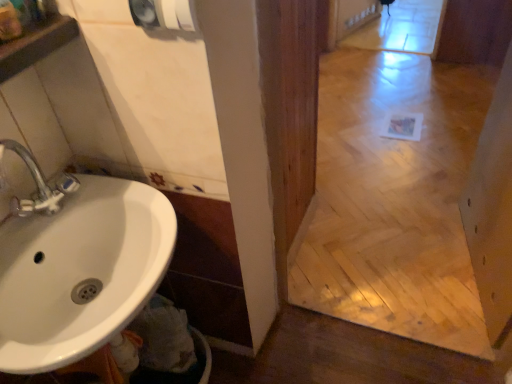
Question: In terms of height, does matte gray hand dryer at upper center look taller or shorter compared to white glossy sink at lower left?

Choices:
 (A) short
 (B) tall

Answer: (A)

Question: Considering the positions of matte gray hand dryer at upper center and white glossy sink at lower left in the image, is matte gray hand dryer at upper center bigger or smaller than white glossy sink at lower left?

Choices:
 (A) small
 (B) big

Answer: (A)

Question: From the image's perspective, is matte gray hand dryer at upper center positioned above or below white glossy sink at lower left?

Choices:
 (A) below
 (B) above

Answer: (B)

Question: From their relative heights in the image, would you say white glossy sink at lower left is taller or shorter than matte gray hand dryer at upper center?

Choices:
 (A) tall
 (B) short

Answer: (A)

Question: Considering the positions of white glossy sink at lower left and matte gray hand dryer at upper center in the image, is white glossy sink at lower left wider or thinner than matte gray hand dryer at upper center?

Choices:
 (A) wide
 (B) thin

Answer: (A)

Question: Does point (37, 213) appear closer or farther from the camera than point (153, 3)?

Choices:
 (A) farther
 (B) closer

Answer: (A)

Question: Choose the correct answer: Is white glossy sink at lower left inside matte gray hand dryer at upper center or outside it?

Choices:
 (A) inside
 (B) outside

Answer: (B)